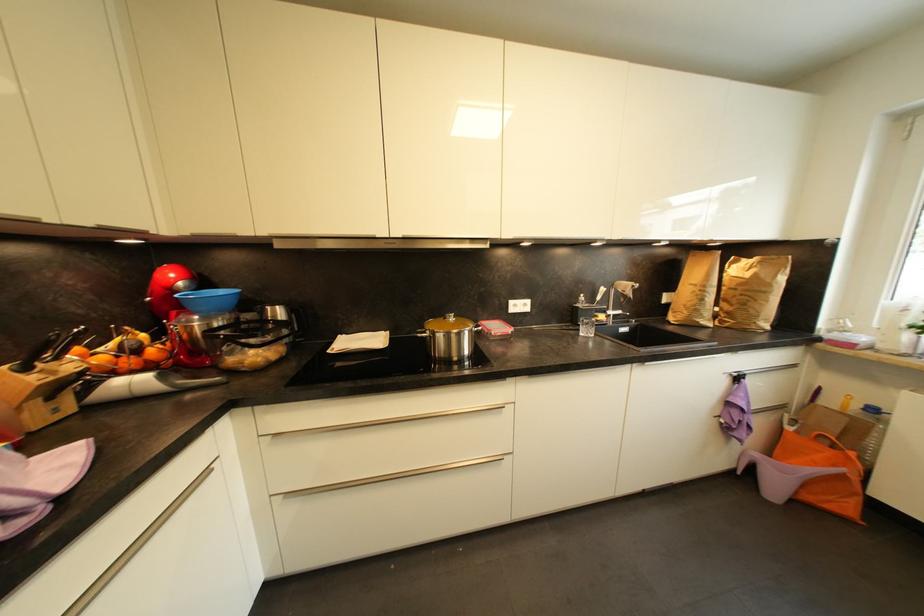
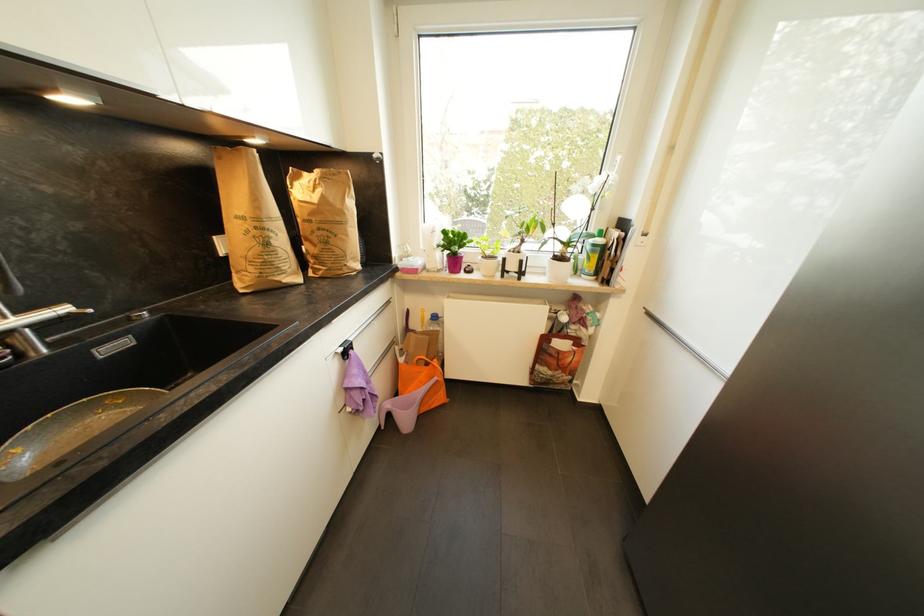
The point at [707,302] is marked in the first image. Where is the corresponding point in the second image?

(272, 246)